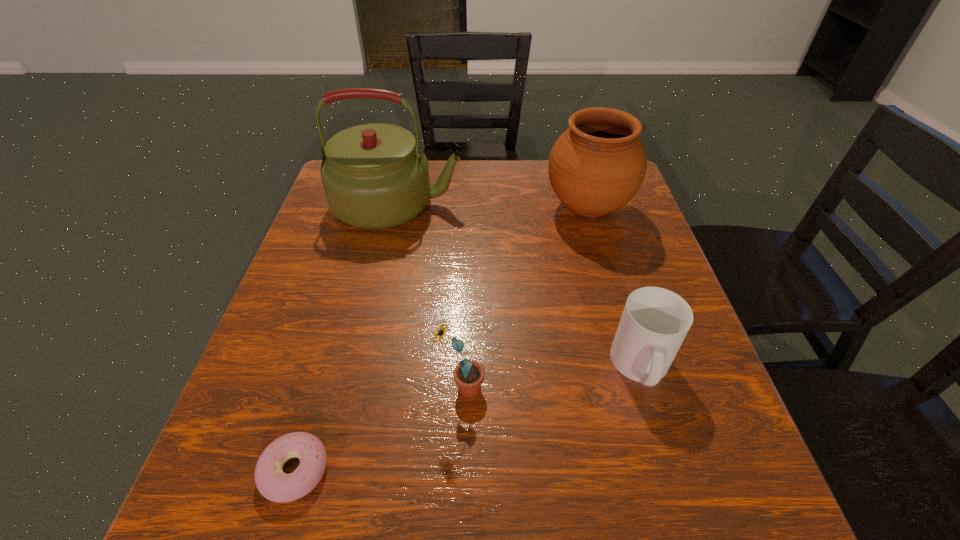
Where is `vacant space that is in between the second tallest object and the kettle`? vacant space that is in between the second tallest object and the kettle is located at coordinates (492, 206).

I want to click on free area in between the second tallest object and the tallest object, so click(x=492, y=206).

I want to click on free space that is in between the third shortest object and the kettle, so click(429, 296).

I want to click on vacant space that is in between the mug and the doughnut, so click(x=468, y=418).

The image size is (960, 540). I want to click on empty location between the second shortest object and the tallest object, so click(519, 285).

Locate an element on the screen. The height and width of the screenshot is (540, 960). the closest object to the fourth shortest object is located at coordinates (374, 176).

Where is `object that stands as the second closest to the sunflower`? This screenshot has height=540, width=960. object that stands as the second closest to the sunflower is located at coordinates (655, 321).

Find the location of `vacant space that satisfies the following two spatial constraints: 1. on the handle side of the mug; 2. on the flower of the sunflower`. vacant space that satisfies the following two spatial constraints: 1. on the handle side of the mug; 2. on the flower of the sunflower is located at coordinates (x=648, y=388).

Locate an element on the screen. vacant space that satisfies the following two spatial constraints: 1. on the front side of the fourth shortest object; 2. on the flower of the sunflower is located at coordinates (639, 388).

This screenshot has height=540, width=960. I want to click on vacant space that satisfies the following two spatial constraints: 1. on the handle side of the second shortest object; 2. on the flower of the sunflower, so click(x=648, y=388).